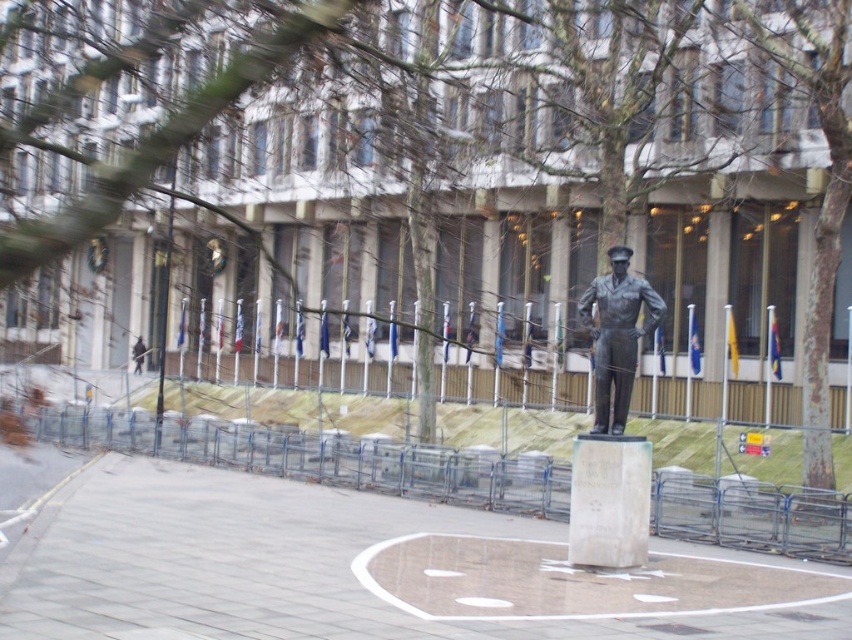
Which is more to the right, white marble stone at center or bronze statue at center?

Positioned to the right is bronze statue at center.

Between white marble stone at center and bronze statue at center, which one is positioned lower?

white marble stone at center is below.

Locate an element on the screen. The width and height of the screenshot is (852, 640). white marble stone at center is located at coordinates (609, 500).